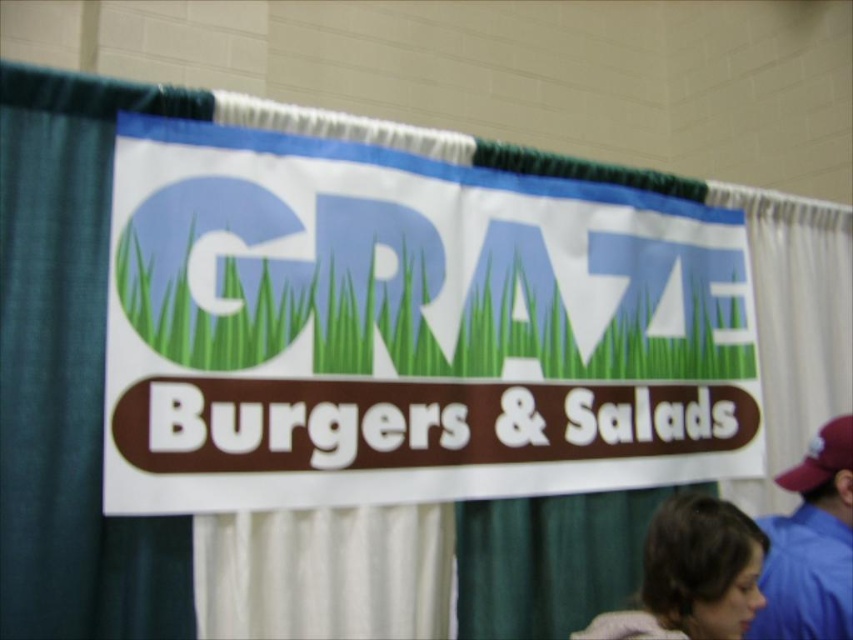
Which of these two, white paper sign at center or blue fabric cap at upper right, stands shorter?

Standing shorter between the two is blue fabric cap at upper right.

I want to click on white paper sign at center, so click(408, 330).

Who is positioned more to the left, brown hair at lower right or blue fabric cap at upper right?

brown hair at lower right is more to the left.

Between brown hair at lower right and blue fabric cap at upper right, which one is positioned lower?

blue fabric cap at upper right is below.

Is point (694, 515) positioned after point (843, 483)?

No, it is not.

Where is `brown hair at lower right`? The image size is (853, 640). brown hair at lower right is located at coordinates (692, 573).

Does point (399, 342) lie in front of point (730, 628)?

That is False.

I want to click on white paper sign at center, so click(x=408, y=330).

Which is behind, point (405, 250) or point (679, 552)?

The point (405, 250) is behind.

What are the coordinates of `white paper sign at center` in the screenshot? It's located at (408, 330).